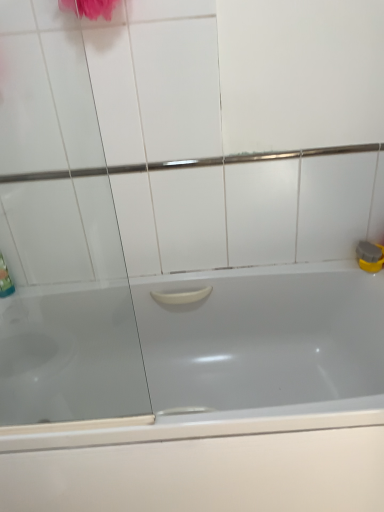
Question: Is transparent glass screen door at left far away from white glossy bathtub at center?

Choices:
 (A) yes
 (B) no

Answer: (B)

Question: Is transparent glass screen door at left shorter than white glossy bathtub at center?

Choices:
 (A) no
 (B) yes

Answer: (A)

Question: Is transparent glass screen door at left facing away from white glossy bathtub at center?

Choices:
 (A) no
 (B) yes

Answer: (A)

Question: Can you confirm if transparent glass screen door at left is positioned to the right of white glossy bathtub at center?

Choices:
 (A) no
 (B) yes

Answer: (A)

Question: Is white glossy bathtub at center located within transparent glass screen door at left?

Choices:
 (A) yes
 (B) no

Answer: (B)

Question: Is transparent glass screen door at left touching white glossy bathtub at center?

Choices:
 (A) no
 (B) yes

Answer: (A)

Question: Is white glossy bathtub at center positioned with its back to transparent glass screen door at left?

Choices:
 (A) no
 (B) yes

Answer: (A)

Question: Is white glossy bathtub at center to the left of transparent glass screen door at left from the viewer's perspective?

Choices:
 (A) yes
 (B) no

Answer: (B)

Question: Can you confirm if white glossy bathtub at center is positioned to the right of transparent glass screen door at left?

Choices:
 (A) no
 (B) yes

Answer: (B)

Question: From a real-world perspective, is white glossy bathtub at center located higher than transparent glass screen door at left?

Choices:
 (A) yes
 (B) no

Answer: (B)

Question: From the image's perspective, would you say white glossy bathtub at center is shown under transparent glass screen door at left?

Choices:
 (A) yes
 (B) no

Answer: (A)

Question: Can you confirm if white glossy bathtub at center is bigger than transparent glass screen door at left?

Choices:
 (A) no
 (B) yes

Answer: (B)

Question: From the image's perspective, is transparent glass screen door at left positioned above or below white glossy bathtub at center?

Choices:
 (A) above
 (B) below

Answer: (A)